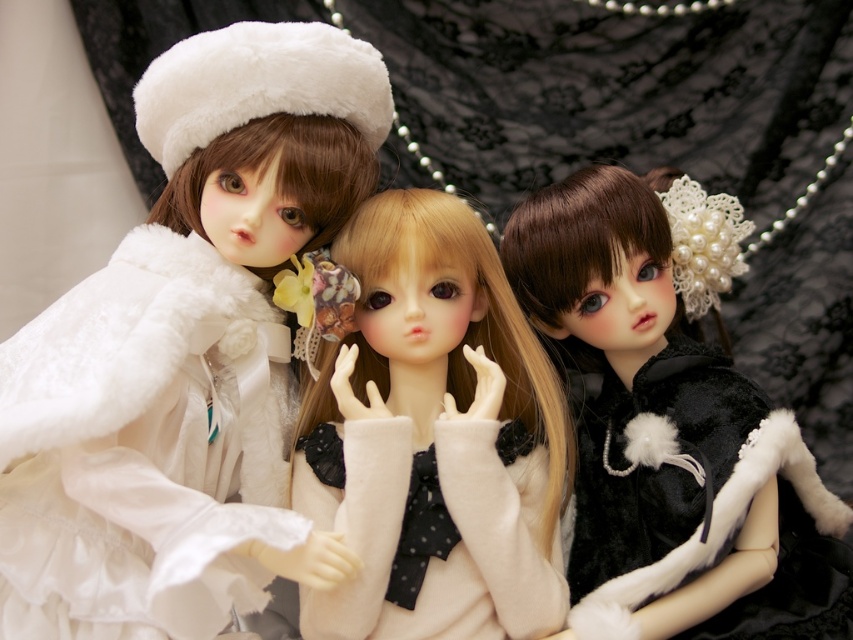
You are a photographer setting up a photo shoot with these dolls. You want to ensure that the velvet black coat at center and the matte white sweater at center are positioned so that there is enough space between them for a small decorative item. The item requires at least 6 inches of space to fit. Based on the current arrangement, will the space between them accommodate the item?

The distance between the velvet black coat at center and the matte white sweater at center is 6.53 inches, which is more than the required 6 inches. Therefore, the space is sufficient to place the small decorative item between them.

You are a photographer setting up a shoot with three dolls against a dark backdrop. The dolls are positioned with one on the left, one in the center, and one on the right. You need to place a small prop exactly at the point marked by coordinates (433, 438). According to the scene description, which doll is closest to this point?

The point marked by coordinates (433, 438) indicates the location of the matte white sweater at center, so the central doll is closest to this point.

You are a fashion designer observing the dolls in the image. You need to decide which piece of clothing to recommend for a client who prefers wider garments. Which one between the velvet black coat at center and the matte white sweater at center should you suggest?

The velvet black coat at center is wider than the matte white sweater at center, so it would be the better recommendation for someone preferring wider garments.